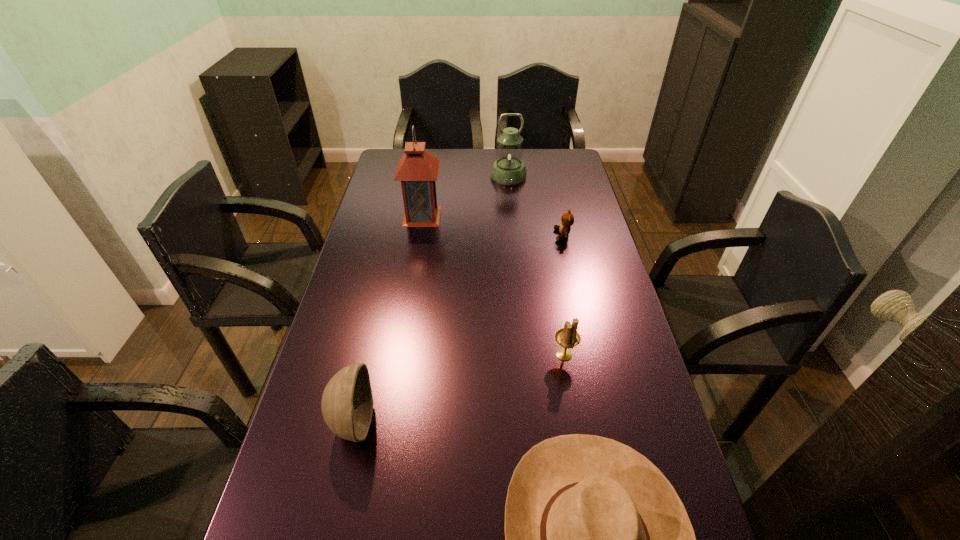
Locate an element on the screen. Image resolution: width=960 pixels, height=540 pixels. free space at the far edge is located at coordinates (432, 151).

The width and height of the screenshot is (960, 540). In order to click on free space at the left edge of the desktop in this screenshot , I will do `click(376, 231)`.

In order to click on vacant area at the right edge in this screenshot , I will do `click(651, 407)`.

The image size is (960, 540). Identify the location of free spot at the far right corner of the desktop. (575, 160).

Where is `vacant area between the shortest object and the bowl`? vacant area between the shortest object and the bowl is located at coordinates (458, 328).

Locate an element on the screen. Image resolution: width=960 pixels, height=540 pixels. blank region between the left lantern and the bowl is located at coordinates (388, 319).

Where is `vacant region between the bowl and the fourth nearest object`? vacant region between the bowl and the fourth nearest object is located at coordinates (458, 328).

Find the location of a particular element. vacant space that is in between the bowl and the farthest object is located at coordinates (431, 299).

You are a GUI agent. You are given a task and a screenshot of the screen. Output one action in this format:
    pyautogui.click(x=<x>, y=<y>)
    Task: Click on the vacant space in between the candle holder and the left lantern
    This screenshot has width=960, height=540.
    Given the screenshot: What is the action you would take?
    pyautogui.click(x=493, y=285)

Locate an element on the screen. Image resolution: width=960 pixels, height=540 pixels. free space between the bowl and the left lantern is located at coordinates (388, 319).